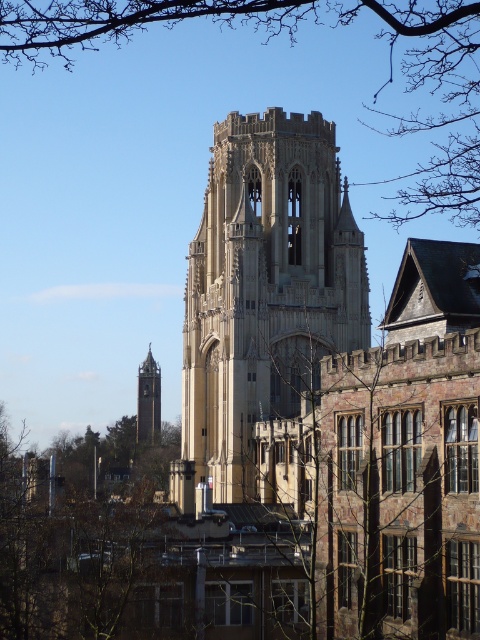
Can you confirm if beige stone tower at center is smaller than brown leafless branches at upper center?

Yes, beige stone tower at center is smaller than brown leafless branches at upper center.

Can you confirm if beige stone tower at center is shorter than brown leafless branches at upper center?

Yes.

Is point (239, 368) less distant than point (442, 38)?

Yes, point (239, 368) is closer to viewer.

Where is `beige stone tower at center`? beige stone tower at center is located at coordinates (264, 294).

Describe the element at coordinates (264, 294) in the screenshot. I see `beige stone tower at center` at that location.

Who is more distant from viewer, (276, 200) or (146, 355)?

Positioned behind is point (146, 355).

Which is in front, point (208, 262) or point (148, 433)?

Point (208, 262) is more forward.

The height and width of the screenshot is (640, 480). I want to click on beige stone tower at center, so click(264, 294).

Does brown leafless branches at upper center have a lesser height compared to smooth stone bell tower at center?

No.

What do you see at coordinates (292, 40) in the screenshot? The width and height of the screenshot is (480, 640). I see `brown leafless branches at upper center` at bounding box center [292, 40].

Does point (192, 3) come closer to viewer compared to point (155, 419)?

Yes, point (192, 3) is closer to viewer.

Where is `brown leafless branches at upper center`? Image resolution: width=480 pixels, height=640 pixels. brown leafless branches at upper center is located at coordinates (292, 40).